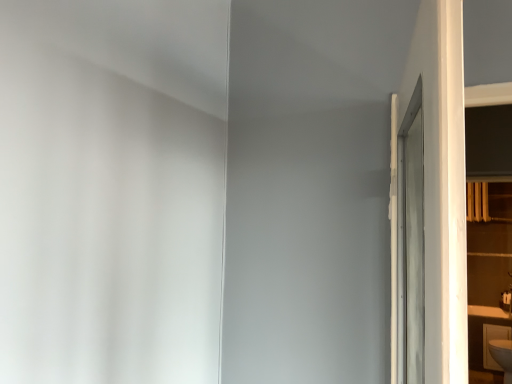
Find the location of a particular element. white glossy shelf at right is located at coordinates (489, 244).

What do you see at coordinates (489, 244) in the screenshot?
I see `white glossy shelf at right` at bounding box center [489, 244].

The image size is (512, 384). Identify the location of white glossy sink at lower right. (495, 341).

Describe the element at coordinates (495, 341) in the screenshot. The width and height of the screenshot is (512, 384). I see `white glossy sink at lower right` at that location.

In order to click on white glossy shelf at right in this screenshot , I will do `click(489, 244)`.

Is white glossy shelf at right at the left side of white glossy sink at lower right?

Yes, white glossy shelf at right is to the left of white glossy sink at lower right.

Considering their positions, is white glossy shelf at right located in front of or behind white glossy sink at lower right?

Clearly, white glossy shelf at right is in front of white glossy sink at lower right.

Is point (490, 196) behind point (492, 328)?

Yes, point (490, 196) is farther from viewer.

From the image's perspective, relative to white glossy sink at lower right, is white glossy shelf at right above or below?

white glossy shelf at right is above white glossy sink at lower right.

From the picture: From a real-world perspective, is white glossy shelf at right over white glossy sink at lower right?

Yes, from a real-world perspective, white glossy shelf at right is above white glossy sink at lower right.

Which of these two, white glossy shelf at right or white glossy sink at lower right, is wider?

Wider between the two is white glossy sink at lower right.

Who is shorter, white glossy shelf at right or white glossy sink at lower right?

white glossy sink at lower right is shorter.

Between white glossy shelf at right and white glossy sink at lower right, which one has smaller size?

Smaller between the two is white glossy sink at lower right.

Looking at this image, is white glossy shelf at right outside of white glossy sink at lower right?

Yes.

Are white glossy shelf at right and white glossy sink at lower right located far from each other?

They are positioned close to each other.

Is white glossy shelf at right aimed at white glossy sink at lower right?

No, white glossy shelf at right does not turn towards white glossy sink at lower right.

How far apart are white glossy shelf at right and white glossy sink at lower right?

white glossy shelf at right is 69.97 centimeters away from white glossy sink at lower right.

The height and width of the screenshot is (384, 512). I want to click on shelf that is above the white glossy sink at lower right (from a real-world perspective), so click(x=489, y=244).

Visually, is white glossy sink at lower right positioned to the left or to the right of white glossy shelf at right?

white glossy sink at lower right is to the right of white glossy shelf at right.

Consider the image. Considering the positions of objects white glossy sink at lower right and white glossy shelf at right in the image provided, who is behind, white glossy sink at lower right or white glossy shelf at right?

Positioned behind is white glossy sink at lower right.

Considering the points (498, 328) and (504, 202), which point is in front, point (498, 328) or point (504, 202)?

The point (498, 328) is closer.

From the image's perspective, is white glossy sink at lower right beneath white glossy shelf at right?

Yes, from the image's perspective, white glossy sink at lower right is below white glossy shelf at right.

From a real-world perspective, is white glossy sink at lower right positioned above or below white glossy shelf at right?

From a real-world perspective, white glossy sink at lower right is physically below white glossy shelf at right.

In terms of width, does white glossy sink at lower right look wider or thinner when compared to white glossy shelf at right?

Considering their sizes, white glossy sink at lower right looks broader than white glossy shelf at right.

Does white glossy sink at lower right have a lesser height compared to white glossy shelf at right?

Yes, white glossy sink at lower right is shorter than white glossy shelf at right.

Does white glossy sink at lower right have a larger size compared to white glossy shelf at right?

No.

Is white glossy sink at lower right outside of white glossy shelf at right?

Yes, white glossy sink at lower right is located beyond the bounds of white glossy shelf at right.

Are white glossy sink at lower right and white glossy shelf at right located far from each other?

No.

Is white glossy sink at lower right oriented towards white glossy shelf at right?

No, white glossy sink at lower right is not aimed at white glossy shelf at right.

What's the angular difference between white glossy sink at lower right and white glossy shelf at right's facing directions?

They differ by 91.5 degrees in their facing directions.

Find the location of `cabinetry on the right of the white glossy shelf at right`. cabinetry on the right of the white glossy shelf at right is located at coordinates (495, 341).

This screenshot has height=384, width=512. I want to click on shelf on the left of white glossy sink at lower right, so tap(489, 244).

The image size is (512, 384). I want to click on shelf in front of the white glossy sink at lower right, so click(489, 244).